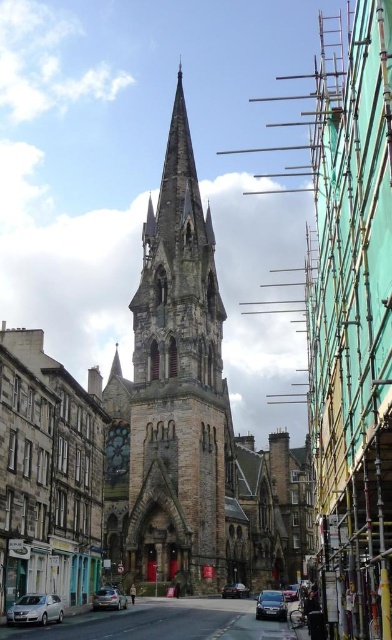
Question: Observing the image, what is the correct spatial positioning of satin silver sedan at lower left in reference to shiny silver sedan at center?

Choices:
 (A) left
 (B) right

Answer: (A)

Question: Which of the following is the farthest from the observer?

Choices:
 (A) rustic stone tower at center
 (B) metallic silver car at center
 (C) shiny black sedan at center

Answer: (B)

Question: Is satin silver sedan at lower left positioned in front of shiny black sedan at center?

Choices:
 (A) no
 (B) yes

Answer: (B)

Question: Can you confirm if shiny silver sedan at center is positioned to the right of metallic silver car at lower left?

Choices:
 (A) no
 (B) yes

Answer: (B)

Question: Which of the following is the closest to the observer?

Choices:
 (A) (270, 602)
 (B) (12, 616)

Answer: (B)

Question: Among these objects, which one is farthest from the camera?

Choices:
 (A) metallic silver car at center
 (B) shiny silver sedan at center
 (C) shiny black sedan at center
 (D) rustic stone tower at center

Answer: (A)